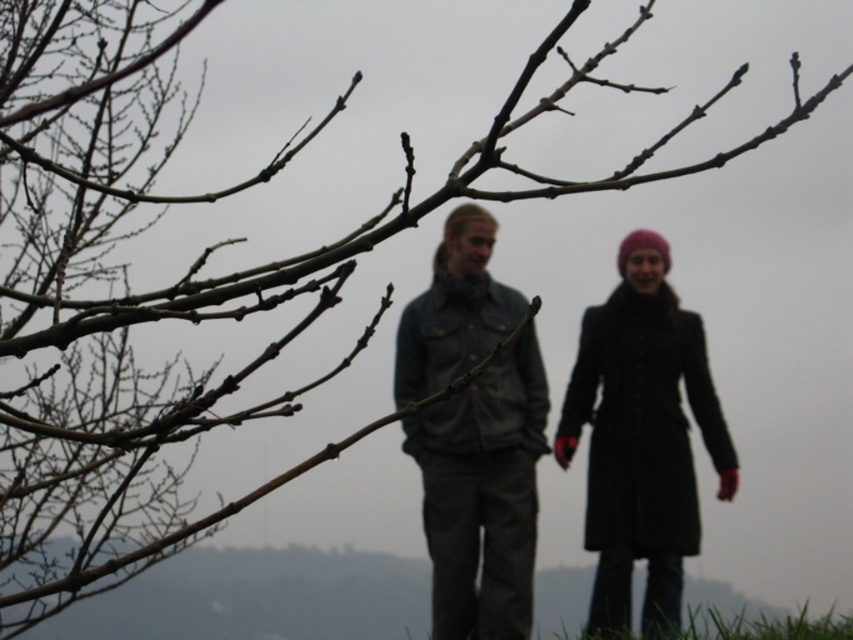
Find the location of a particular element. This screenshot has width=853, height=640. denim jacket at center is located at coordinates (483, 493).

Is denim jacket at center thinner than matte black coat at center?

Correct, denim jacket at center's width is less than matte black coat at center's.

Identify the location of denim jacket at center. (483, 493).

Is point (405, 364) positioned in front of point (614, 636)?

No, it is behind (614, 636).

Between denim jacket at center and green grass at lower center, which one is positioned higher?

denim jacket at center

Is point (438, 262) positioned in front of point (746, 628)?

That is False.

This screenshot has height=640, width=853. Identify the location of denim jacket at center. (483, 493).

Does matte black coat at center appear on the right side of green grass at lower center?

No, matte black coat at center is not to the right of green grass at lower center.

Between point (614, 484) and point (614, 634), which one is positioned behind?

The point (614, 484) is behind.

You are a GUI agent. You are given a task and a screenshot of the screen. Output one action in this format:
    pyautogui.click(x=<x>, y=<y>)
    Task: Click on the matte black coat at center
    
    Given the screenshot: What is the action you would take?
    pyautogui.click(x=641, y=436)